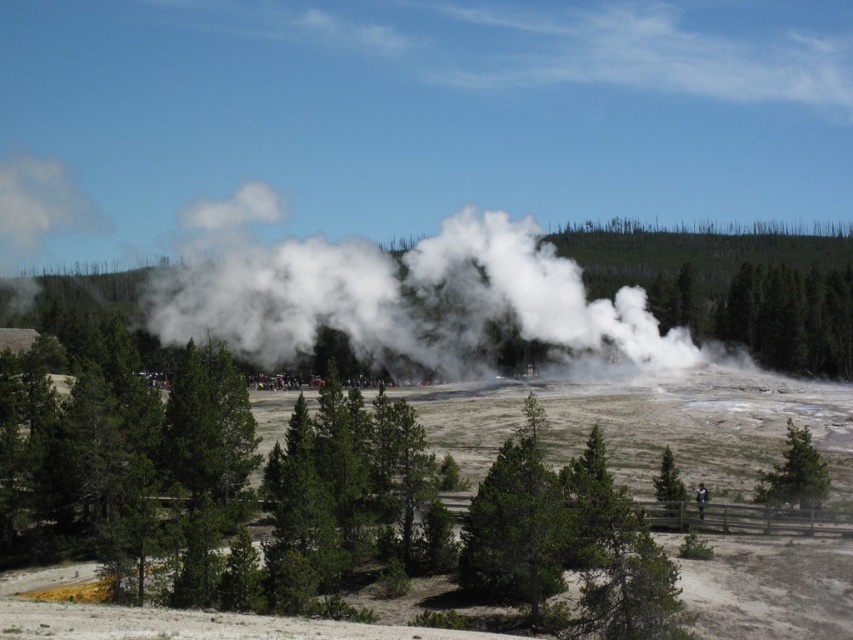
Question: Is the position of white vapor steam at center less distant than that of green matte tree at center?

Choices:
 (A) no
 (B) yes

Answer: (A)

Question: Which point appears closest to the camera in this image?

Choices:
 (A) (665, 493)
 (B) (459, 291)
 (C) (757, 499)

Answer: (A)

Question: Is white vapor steam at center behind green matte tree at lower right?

Choices:
 (A) yes
 (B) no

Answer: (A)

Question: Does white vapor steam at center have a larger size compared to green matte tree at center?

Choices:
 (A) yes
 (B) no

Answer: (A)

Question: Which object is the farthest from the green matte tree at center?

Choices:
 (A) white vapor steam at center
 (B) green matte tree at lower right

Answer: (A)

Question: Which object is the farthest from the green matte tree at lower right?

Choices:
 (A) green matte tree at center
 (B) white vapor steam at center

Answer: (B)